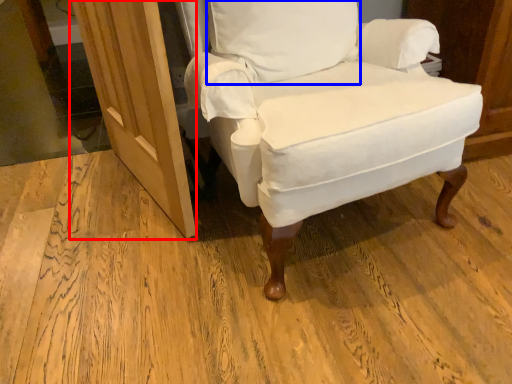
Question: Which object is further to the camera taking this photo, screen door (highlighted by a red box) or pillow (highlighted by a blue box)?

Choices:
 (A) screen door
 (B) pillow

Answer: (B)